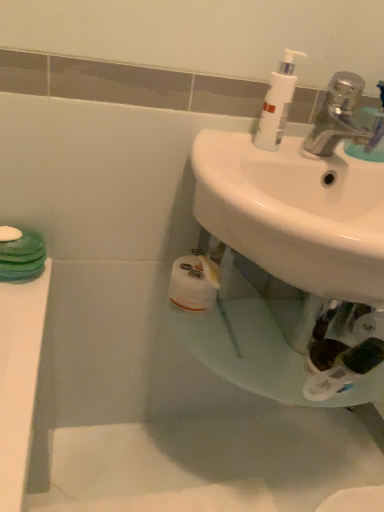
Question: Is white glossy sink at center wider than silver metallic faucet at upper right?

Choices:
 (A) yes
 (B) no

Answer: (A)

Question: Is white glossy sink at center smaller than silver metallic faucet at upper right?

Choices:
 (A) yes
 (B) no

Answer: (B)

Question: From a real-world perspective, is white glossy sink at center on top of silver metallic faucet at upper right?

Choices:
 (A) yes
 (B) no

Answer: (B)

Question: Is white glossy sink at center positioned with its back to silver metallic faucet at upper right?

Choices:
 (A) no
 (B) yes

Answer: (A)

Question: Is white glossy sink at center closer to camera compared to silver metallic faucet at upper right?

Choices:
 (A) no
 (B) yes

Answer: (B)

Question: Considering the positions of white plastic pump bottle at upper right and silver metallic faucet at upper right in the image, is white plastic pump bottle at upper right wider or thinner than silver metallic faucet at upper right?

Choices:
 (A) thin
 (B) wide

Answer: (A)

Question: From a real-world perspective, is white plastic pump bottle at upper right physically located above or below silver metallic faucet at upper right?

Choices:
 (A) above
 (B) below

Answer: (A)

Question: Is point (x=281, y=125) positioned closer to the camera than point (x=317, y=150)?

Choices:
 (A) farther
 (B) closer

Answer: (A)

Question: Is white plastic pump bottle at upper right in front of or behind silver metallic faucet at upper right in the image?

Choices:
 (A) front
 (B) behind

Answer: (B)

Question: From the image's perspective, is white glossy sink at center positioned above or below white plastic pump bottle at upper right?

Choices:
 (A) below
 (B) above

Answer: (A)

Question: From a real-world perspective, is white glossy sink at center above or below white plastic pump bottle at upper right?

Choices:
 (A) below
 (B) above

Answer: (A)

Question: Looking at the image, does white glossy sink at center seem bigger or smaller compared to white plastic pump bottle at upper right?

Choices:
 (A) big
 (B) small

Answer: (A)

Question: From their relative heights in the image, would you say white glossy sink at center is taller or shorter than white plastic pump bottle at upper right?

Choices:
 (A) tall
 (B) short

Answer: (A)

Question: Considering the positions of silver metallic faucet at upper right and white glossy sink at center in the image, is silver metallic faucet at upper right taller or shorter than white glossy sink at center?

Choices:
 (A) short
 (B) tall

Answer: (A)

Question: Considering the positions of silver metallic faucet at upper right and white glossy sink at center in the image, is silver metallic faucet at upper right wider or thinner than white glossy sink at center?

Choices:
 (A) thin
 (B) wide

Answer: (A)